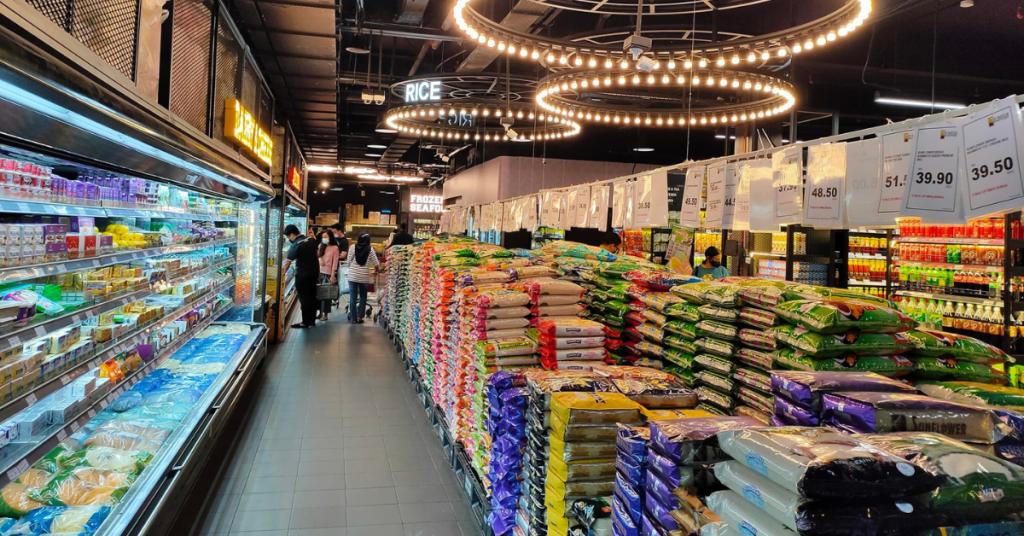
Where is `tile`? This screenshot has height=536, width=1024. tile is located at coordinates (391, 489).